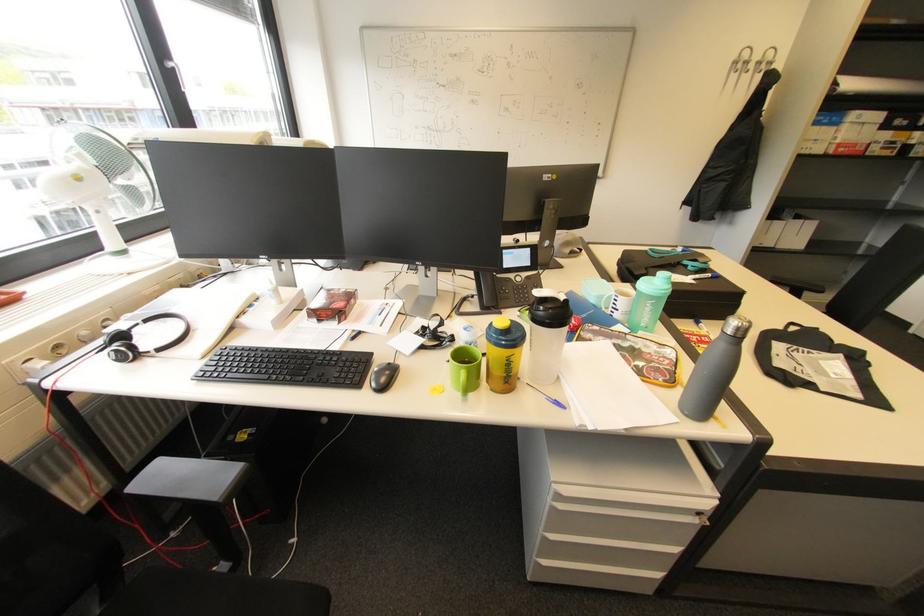
Where would you lift the telephone handset? Please return your answer as a coordinate pair (x, y).

(485, 290)